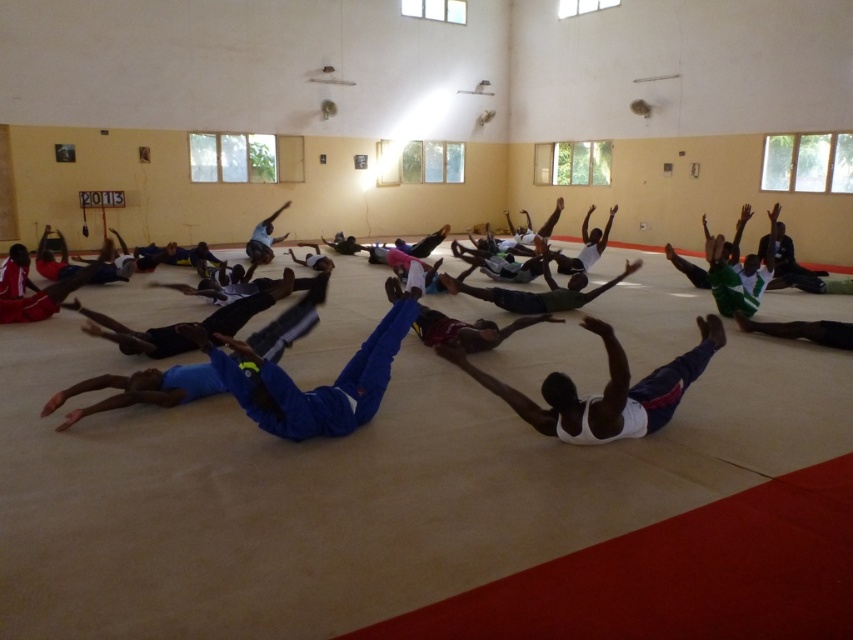
You are a photographer setting up for a group photo in the indoor hall. You need to ensure that both the blue fabric at center and the white tank top at center are visible in the frame. Based on their heights, which object should you adjust your camera angle to focus on first to include both in the shot?

The blue fabric at center is much taller than the white tank top at center, so you should adjust your camera angle to focus on the blue fabric at center first to ensure both are visible.

In the scene shown: You are an instructor observing the exercise session. You notice the blue fabric at center and the white tank top at center. Which clothing item is positioned higher in relation to the participants?

The blue fabric at center is located above the white tank top at center, so it is positioned higher.

You are standing at the center of the indoor hall and want to reach a specific point marked at coordinates point (142, 340). The hall has a red border along one side. Can you estimate how far you need to walk to reach that point?

The distance of point (142, 340) from camera is 5.06 meters, so you need to walk approximately 5.06 meters to reach that point.